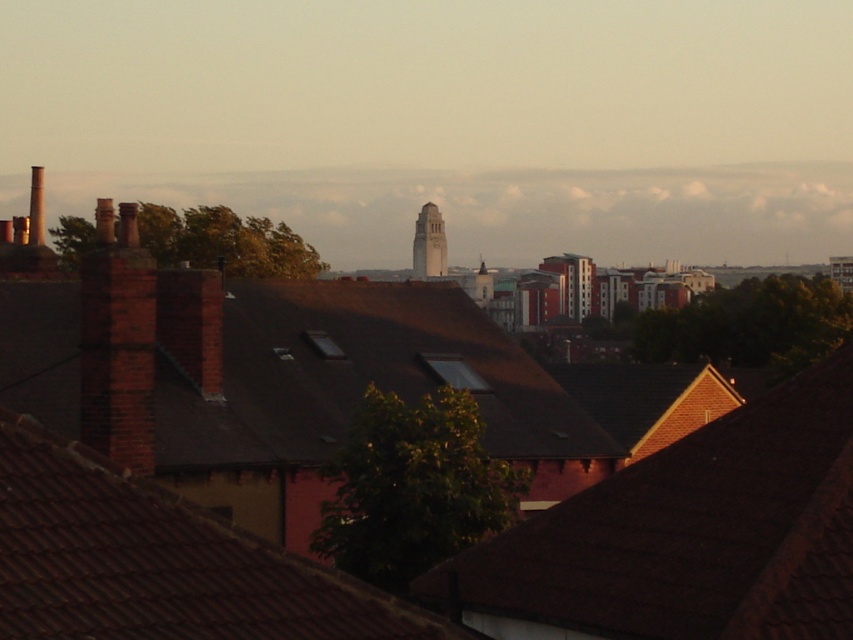
You are an architect analyzing the urban layout. You observe the brown tile roof at lower right and the brown tile roof at center. Which of these two roofs has a greater height?

The brown tile roof at lower right is much taller than the brown tile roof at center, so the brown tile roof at lower right has a greater height.

You are standing in the urban landscape and want to take a photo of the smooth concrete clock tower at center without any obstructions. Is the brown tile roof at lower right blocking your view of the clock tower?

The brown tile roof at lower right is in front of the smooth concrete clock tower at center, so it will block your view of the clock tower.

Consider the image. You are a drone operator tasked with delivering a package to the brown tile roof at center. Your drone must fly over the brick chimney at left to reach it. Is this path possible given their positions?

The brown tile roof at center is located below the brick chimney at left, so the drone can fly over the brick chimney at left to reach the brown tile roof at center as it is positioned lower.